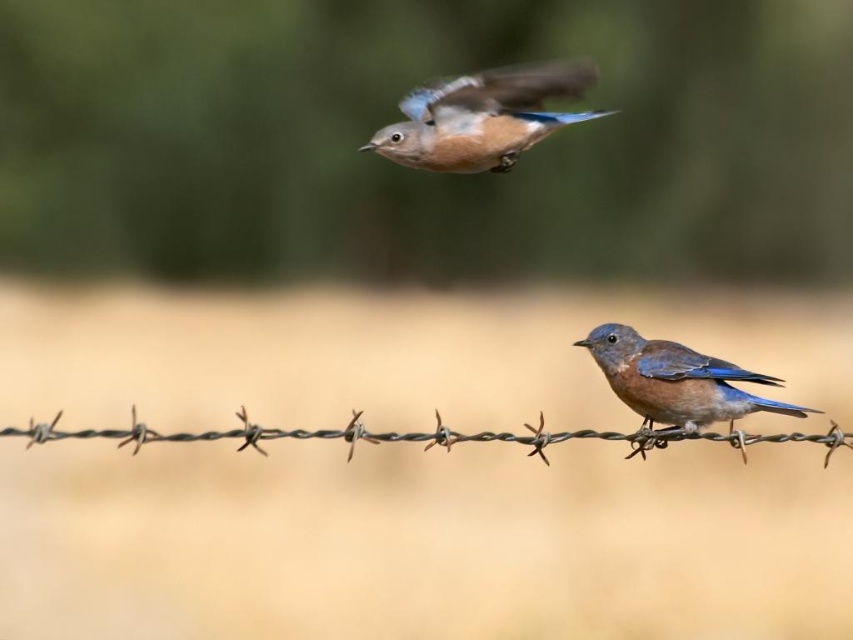
You are a photographer aiming to capture a closeup shot of the blue glossy bird at upper center. Based on the scene description, what is the minimum distance you need to be from the bird to get a clear closeup shot?

The blue glossy bird at upper center is 7.41 feet away from the camera, so the minimum distance you need to be from the bird to get a clear closeup shot is 7.41 feet.